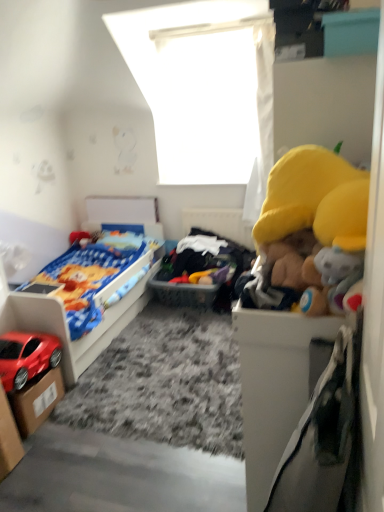
Identify the location of soft plush toys at center. This screenshot has height=512, width=384. (200, 269).

Identify the location of cardboard box at lower left, the 1th storage box when ordered from back to front. This screenshot has height=512, width=384. (36, 400).

This screenshot has width=384, height=512. What do you see at coordinates (36, 400) in the screenshot?
I see `cardboard box at lower left, the 1th storage box when ordered from back to front` at bounding box center [36, 400].

This screenshot has width=384, height=512. What are the coordinates of `cardboard box at lower left, the first storage box when ordered from front to back` in the screenshot? It's located at (8, 438).

You are a GUI agent. You are given a task and a screenshot of the screen. Output one action in this format:
    pyautogui.click(x=<x>, y=<y>)
    Task: Click on the matte plastic bed at left
    This screenshot has height=512, width=384.
    Given the screenshot: What is the action you would take?
    pyautogui.click(x=89, y=286)

Where is `soft plush toys at center`? Image resolution: width=384 pixels, height=512 pixels. soft plush toys at center is located at coordinates coord(200,269).

Consider the image. Could you tell me if matte plastic bed at left is facing white fabric at upper center?

No, matte plastic bed at left is not turned towards white fabric at upper center.

From a real-world perspective, is matte plastic bed at left physically located above or below white fabric at upper center?

Clearly, from a real-world perspective, matte plastic bed at left is below white fabric at upper center.

Which of these two, matte plastic bed at left or white fabric at upper center, is smaller?

white fabric at upper center.

Find the location of a particular element. The width and height of the screenshot is (384, 512). bed in front of the white fabric at upper center is located at coordinates (89, 286).

Looking at the image, does cardboard box at lower left, the 1th storage box when ordered from back to front, seem bigger or smaller compared to shiny red car at lower left?

cardboard box at lower left, the 1th storage box when ordered from back to front, is smaller than shiny red car at lower left.

From the image's perspective, which is below, cardboard box at lower left, the 1th storage box when ordered from back to front, or shiny red car at lower left?

cardboard box at lower left, the 1th storage box when ordered from back to front.

Does cardboard box at lower left, the 1th storage box when ordered from back to front, come in front of shiny red car at lower left?

No, it is not.

Does point (26, 393) appear closer or farther from the camera than point (59, 345)?

Point (26, 393) is closer to the camera than point (59, 345).

Considering the sizes of cardboard box at lower left, the 2th storage box positioned from the front, and white fabric at upper center in the image, is cardboard box at lower left, the 2th storage box positioned from the front, taller or shorter than white fabric at upper center?

In the image, cardboard box at lower left, the 2th storage box positioned from the front, appears to be shorter than white fabric at upper center.

Does point (21, 418) come behind point (179, 169)?

No, (21, 418) is in front of (179, 169).

From the image's perspective, is cardboard box at lower left, the 2th storage box positioned from the front, located above or below white fabric at upper center?

cardboard box at lower left, the 2th storage box positioned from the front, is situated lower than white fabric at upper center in the image.

From a real-world perspective, between cardboard box at lower left, the 1th storage box when ordered from back to front, and white fabric at upper center, who is vertically higher?

white fabric at upper center, from a real-world perspective.

Locate an element on the screen. This screenshot has width=384, height=512. storage box above the cardboard box at lower left, the first storage box when ordered from front to back (from the image's perspective) is located at coordinates (36, 400).

Considering the relative sizes of cardboard box at lower left, the first storage box when ordered from front to back, and cardboard box at lower left, the 1th storage box when ordered from back to front, in the image provided, is cardboard box at lower left, the first storage box when ordered from front to back, thinner than cardboard box at lower left, the 1th storage box when ordered from back to front,?

Correct, the width of cardboard box at lower left, the first storage box when ordered from front to back, is less than that of cardboard box at lower left, the 1th storage box when ordered from back to front.

Considering the points (8, 461) and (15, 399), which point is in front, point (8, 461) or point (15, 399)?

The point (8, 461) is more forward.

Would you say cardboard box at lower left, the first storage box when ordered from front to back, is outside cardboard box at lower left, the 1th storage box when ordered from back to front?

Absolutely, cardboard box at lower left, the first storage box when ordered from front to back, is external to cardboard box at lower left, the 1th storage box when ordered from back to front.

Would you say white fabric at upper center is part of soft plush toys at center's contents?

No, soft plush toys at center does not contain white fabric at upper center.

Considering the sizes of objects soft plush toys at center and white fabric at upper center in the image provided, who is thinner, soft plush toys at center or white fabric at upper center?

white fabric at upper center.

From the image's perspective, between soft plush toys at center and white fabric at upper center, which one is located above?

From the image's view, white fabric at upper center is above.

Which is in front, soft plush toys at center or white fabric at upper center?

soft plush toys at center is more forward.

Are cardboard box at lower left, the first storage box when ordered from front to back, and soft plush toys at center making contact?

No, cardboard box at lower left, the first storage box when ordered from front to back, is not next to soft plush toys at center.

How many degrees apart are the facing directions of cardboard box at lower left, which is the second storage box from back to front, and soft plush toys at center?

They differ by 87.4 degrees in their facing directions.

Looking at this image, from the image's perspective, between cardboard box at lower left, the first storage box when ordered from front to back, and soft plush toys at center, which one is located above?

soft plush toys at center is shown above in the image.

I want to click on toy on the right of cardboard box at lower left, the first storage box when ordered from front to back, so click(x=200, y=269).

Is white fabric at upper center positioned far away from soft plush toys at center?

Actually, white fabric at upper center and soft plush toys at center are a little close together.

Consider the image. From their relative heights in the image, would you say white fabric at upper center is taller or shorter than soft plush toys at center?

Clearly, white fabric at upper center is taller compared to soft plush toys at center.

Considering the points (143, 45) and (224, 281), which point is behind, point (143, 45) or point (224, 281)?

The point (224, 281) is farther.

What's the angular difference between white fabric at upper center and soft plush toys at center's facing directions?

0.74 degrees.

Find the location of a particular element. bed below the white fabric at upper center (from the image's perspective) is located at coordinates (89, 286).

Identify the location of car lying on the left of cardboard box at lower left, the 2th storage box positioned from the front. This screenshot has height=512, width=384. (26, 357).

Considering their positions, is shiny red car at lower left positioned further to white fabric at upper center than matte plastic bed at left?

shiny red car at lower left is further to white fabric at upper center.

Based on their spatial positions, is white fabric at upper center or shiny red car at lower left further from cardboard box at lower left, the first storage box when ordered from front to back?

white fabric at upper center is positioned further to the anchor cardboard box at lower left, the first storage box when ordered from front to back.

From the image, which object appears to be nearer to shiny red car at lower left, cardboard box at lower left, the 2th storage box positioned from the front, or soft plush toys at center?

The object closer to shiny red car at lower left is cardboard box at lower left, the 2th storage box positioned from the front.

Consider the image. Estimate the real-world distances between objects in this image. Which object is further from cardboard box at lower left, the 1th storage box when ordered from back to front, soft plush toys at center or shiny red car at lower left?

soft plush toys at center.

When comparing their distances from soft plush toys at center, does matte plastic bed at left or white fabric at upper center seem further?

Based on the image, white fabric at upper center appears to be further to soft plush toys at center.

Estimate the real-world distances between objects in this image. Which object is further from soft plush toys at center, cardboard box at lower left, which is the second storage box from back to front, or white fabric at upper center?

cardboard box at lower left, which is the second storage box from back to front.

Estimate the real-world distances between objects in this image. Which object is further from white fabric at upper center, cardboard box at lower left, which is the second storage box from back to front, or cardboard box at lower left, the 1th storage box when ordered from back to front?

The object further to white fabric at upper center is cardboard box at lower left, which is the second storage box from back to front.

Consider the image. Estimate the real-world distances between objects in this image. Which object is closer to cardboard box at lower left, the 1th storage box when ordered from back to front, cardboard box at lower left, which is the second storage box from back to front, or matte plastic bed at left?

cardboard box at lower left, which is the second storage box from back to front, is positioned closer to the anchor cardboard box at lower left, the 1th storage box when ordered from back to front.

You are a GUI agent. You are given a task and a screenshot of the screen. Output one action in this format:
    pyautogui.click(x=<x>, y=<y>)
    Task: Click on the bed located between cardboard box at lower left, the first storage box when ordered from front to back, and soft plush toys at center in the depth direction
    Image resolution: width=384 pixels, height=512 pixels.
    Given the screenshot: What is the action you would take?
    pyautogui.click(x=89, y=286)

Identify the location of storage box that lies between white fabric at upper center and cardboard box at lower left, the first storage box when ordered from front to back, from top to bottom. The height and width of the screenshot is (512, 384). (36, 400).

The image size is (384, 512). In order to click on car positioned between cardboard box at lower left, the first storage box when ordered from front to back, and cardboard box at lower left, the 1th storage box when ordered from back to front, from near to far in this screenshot , I will do `click(26, 357)`.

Locate an element on the screen. This screenshot has height=512, width=384. car between cardboard box at lower left, which is the second storage box from back to front, and matte plastic bed at left in the front-back direction is located at coordinates (26, 357).